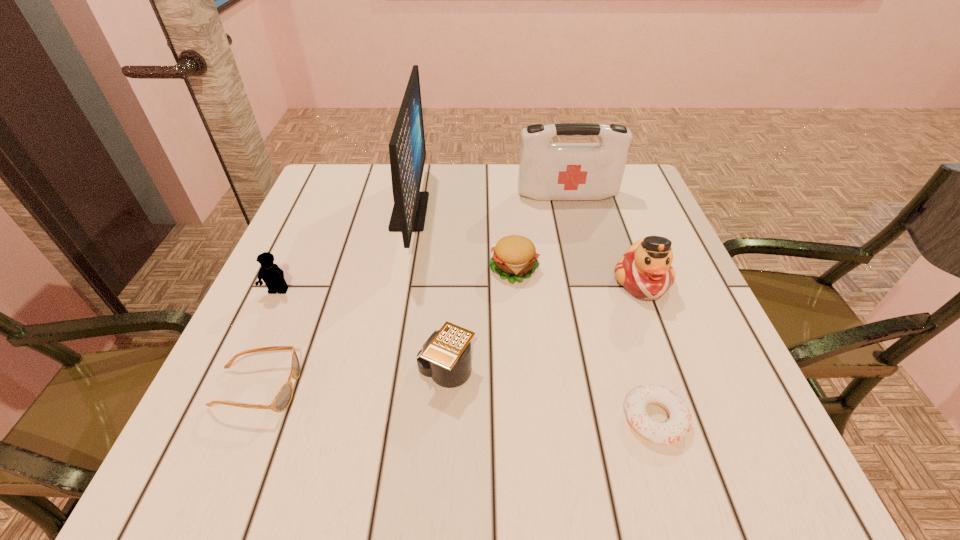
Image resolution: width=960 pixels, height=540 pixels. In order to click on blank region between the hamburger and the sixth shortest object in this screenshot , I will do tap(578, 275).

Identify the location of vacant space in between the fifth shortest object and the third tallest object. tap(460, 287).

The width and height of the screenshot is (960, 540). Identify the location of object that is the third closest to the hamburger. (445, 356).

Where is `object that is the sixth closest one to the fourth tallest object`? This screenshot has height=540, width=960. object that is the sixth closest one to the fourth tallest object is located at coordinates (679, 423).

You are a GUI agent. You are given a task and a screenshot of the screen. Output one action in this format:
    pyautogui.click(x=<x>, y=<y>)
    Task: Click on the vacant region that satisfies the following two spatial constraints: 1. on the screen side of the computer monitor; 2. on the front-facing side of the fourth tallest object
    Image resolution: width=960 pixels, height=540 pixels.
    Given the screenshot: What is the action you would take?
    pyautogui.click(x=395, y=291)

Identify the location of vacant space that satisfies the following two spatial constraints: 1. on the screen side of the sixth object from right to left; 2. on the left side of the shortest object. (370, 418).

Identify the location of free region that satisfies the following two spatial constraints: 1. on the screen side of the third object from left to right; 2. on the front-facing side of the Lego. Image resolution: width=960 pixels, height=540 pixels. (395, 291).

At what (x,y) coordinates should I click in order to perform the action: click on free space that satisfies the following two spatial constraints: 1. on the face of the duck; 2. on the front-facing side of the sunglasses. Please return your answer as a coordinate pair (x, y). Image resolution: width=960 pixels, height=540 pixels. Looking at the image, I should click on (682, 388).

Identify the location of vacant space that satisfies the following two spatial constraints: 1. on the front side of the shortest object; 2. on the right side of the second tallest object. The width and height of the screenshot is (960, 540). pos(623,418).